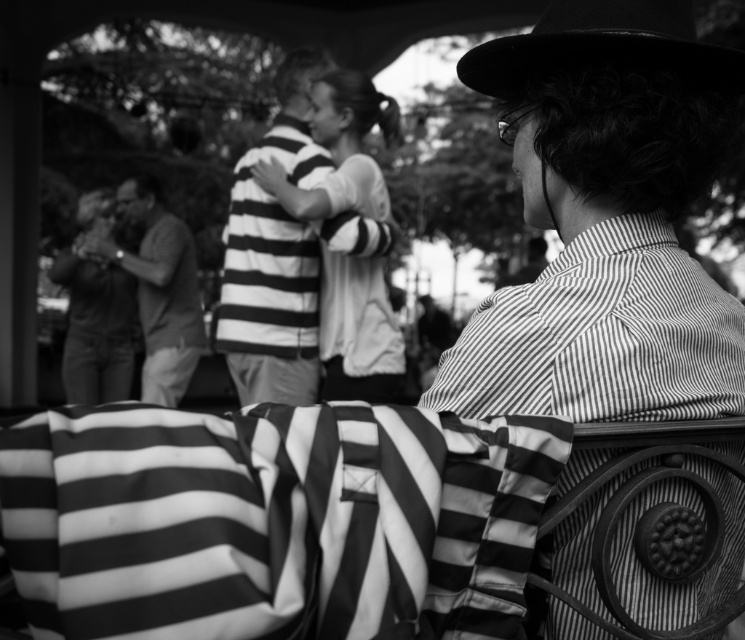
Question: Based on their relative distances, which object is nearer to the black felt hat at upper right?

Choices:
 (A) striped fabric shirt at center
 (B) striped shirt at left

Answer: (A)

Question: Is striped fabric shirt at center to the left of striped shirt at left from the viewer's perspective?

Choices:
 (A) no
 (B) yes

Answer: (A)

Question: Does striped fabric shirt at center have a greater width compared to black felt hat at upper right?

Choices:
 (A) no
 (B) yes

Answer: (B)

Question: Which object is farther from the camera taking this photo?

Choices:
 (A) striped fabric shirt at center
 (B) black felt hat at upper right

Answer: (A)

Question: Is black felt hat at upper right further to the viewer compared to striped shirt at left?

Choices:
 (A) no
 (B) yes

Answer: (A)

Question: Which point is farther to the camera?

Choices:
 (A) striped shirt at left
 (B) striped fabric shirt at center
 (C) black felt hat at upper right

Answer: (A)